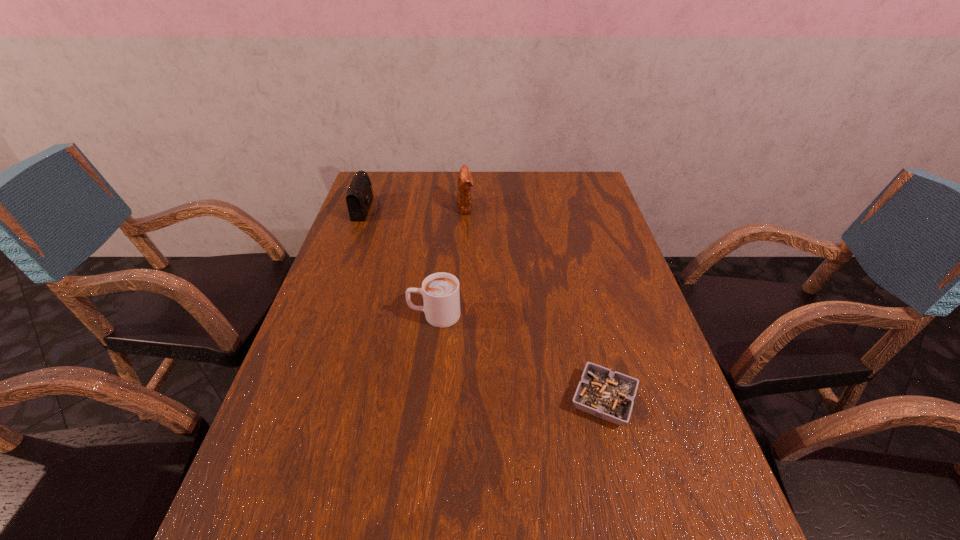
Identify which object is the third nearest to the nearest object. Please provide its 2D coordinates. Your answer should be formatted as a tuple, i.e. [(x, y)], where the tuple contains the x and y coordinates of a point satisfying the conditions above.

[(359, 197)]

The image size is (960, 540). I want to click on object that is the second closest to the leftmost object, so (441, 296).

You are a GUI agent. You are given a task and a screenshot of the screen. Output one action in this format:
    pyautogui.click(x=<x>, y=<y>)
    Task: Click on the free region that satisfies the following two spatial constraints: 1. on the side with the handle of the ashtray; 2. on the right side of the cappuccino
    
    Given the screenshot: What is the action you would take?
    pyautogui.click(x=425, y=400)

I want to click on free location that satisfies the following two spatial constraints: 1. on the back side of the rightmost object; 2. on the side with the handle of the cappuccino, so click(x=583, y=315).

Where is `free spot that satisfies the following two spatial constraints: 1. on the side with the handle of the cappuccino; 2. on the left side of the shortest object`? free spot that satisfies the following two spatial constraints: 1. on the side with the handle of the cappuccino; 2. on the left side of the shortest object is located at coordinates (425, 400).

At what (x,y) coordinates should I click in order to perform the action: click on vacant point that satisfies the following two spatial constraints: 1. on the open side of the nearest object; 2. on the right side of the right clutch bag. Please return your answer as a coordinate pair (x, y). The width and height of the screenshot is (960, 540). Looking at the image, I should click on tap(457, 400).

What are the coordinates of `free location that satisfies the following two spatial constraints: 1. on the front flap of the shorter clutch bag; 2. on the left side of the rightmost object` in the screenshot? It's located at (297, 400).

The image size is (960, 540). Identify the location of free point that satisfies the following two spatial constraints: 1. on the front flap of the leftmost object; 2. on the back side of the ashtray. (297, 400).

Find the location of a particular element. This screenshot has height=540, width=960. free point that satisfies the following two spatial constraints: 1. on the side with the handle of the second nearest object; 2. on the back side of the nearest object is located at coordinates (425, 400).

Find the location of a particular element. This screenshot has width=960, height=540. blank area in the image that satisfies the following two spatial constraints: 1. on the back side of the shortest object; 2. on the side with the handle of the cappuccino is located at coordinates (583, 315).